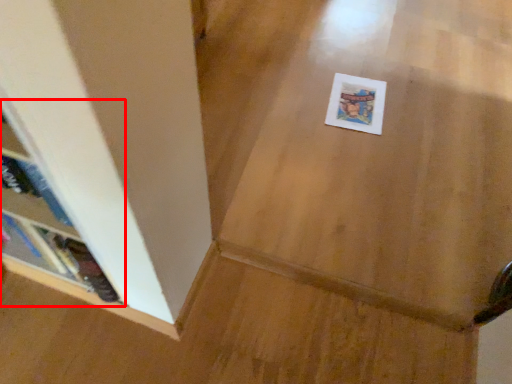
Question: From the image's perspective, where is shelf (annotated by the red box) located in relation to postcard in the image?

Choices:
 (A) below
 (B) above

Answer: (A)